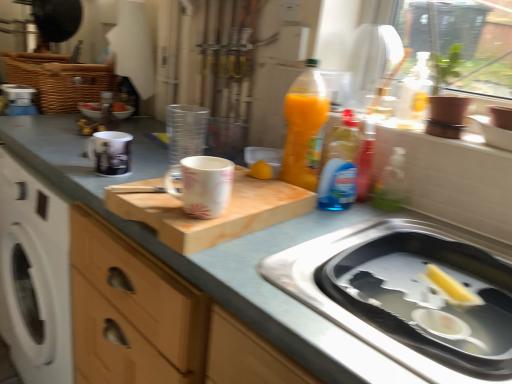
Question: Is matte white mug at upper left, which is the 2th mug from front to back, spatially inside translucent plastic bottle at upper center, which is counted as the first bottle, starting from the bottom, or outside of it?

Choices:
 (A) inside
 (B) outside

Answer: (B)

Question: From their relative heights in the image, would you say matte white mug at upper left, which ranks as the first mug in back-to-front order, is taller or shorter than translucent plastic bottle at upper center, which is the second bottle from top to bottom?

Choices:
 (A) short
 (B) tall

Answer: (A)

Question: Which of these objects is positioned closest to the matte wooden cutting board at center?

Choices:
 (A) pink floral ceramic mug at center, which is counted as the 1th mug, starting from the right
 (B) stainless steel sink at lower right
 (C) yellow rubber duck at sink right
 (D) wooden cutting board at center
 (E) metallic silver bottle at upper center, which ranks as the second bottle in front-to-back order

Answer: (D)

Question: Considering the real-world distances, which object is closest to the translucent plastic bottle at upper center, positioned as the first bottle in right-to-left order?

Choices:
 (A) matte wooden cutting board at center
 (B) matte white mug at upper left, the second mug positioned from the right
 (C) stainless steel sink at lower right
 (D) pink floral ceramic mug at center, the 2th mug when ordered from left to right
 (E) metallic silver bottle at upper center, marked as the 1th bottle in a top-to-bottom arrangement

Answer: (C)